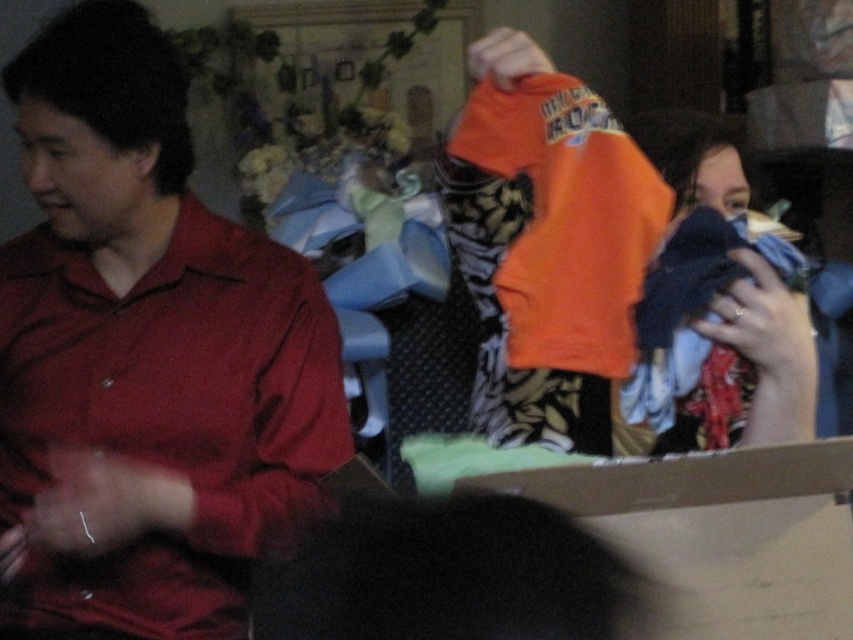
You are organizing a charity event and need to place the matte red shirt at left and the cardboard box at center in a display. Based on the scene, which object should be placed to the right of the other?

The cardboard box at center should be placed to the right of the matte red shirt at left because the matte red shirt at left is positioned on the left side of the cardboard box at center.

You are organizing a charity event and need to decide which item to place on a 1.2 meter wide table. The matte red shirt at left and the cardboard box at center are both candidates. Based on their sizes, which item would occupy more space on the table?

The matte red shirt at left has a larger width than the cardboard box at center, so it would occupy more space on the table.

What is the location of the point at coordinates [720,532] in the image?

The point at coordinates [720,532] is on the cardboard box at center.